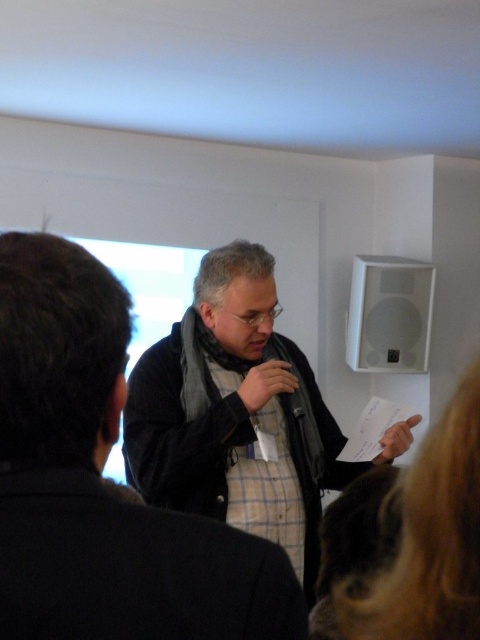
Question: Which is farther from the blonde hair at lower right?

Choices:
 (A) matte black jacket at center
 (B) dark gray fabric jacket at center

Answer: (A)

Question: Does matte black jacket at center appear on the left side of blonde hair at lower right?

Choices:
 (A) no
 (B) yes

Answer: (B)

Question: Does matte black jacket at center appear over blonde hair at lower right?

Choices:
 (A) yes
 (B) no

Answer: (B)

Question: Which object is positioned farthest from the blonde hair at lower right?

Choices:
 (A) matte black jacket at center
 (B) dark gray fabric jacket at center

Answer: (A)

Question: Can you confirm if matte black jacket at center is positioned to the right of blonde hair at lower right?

Choices:
 (A) no
 (B) yes

Answer: (A)

Question: Estimate the real-world distances between objects in this image. Which object is closer to the dark gray fabric jacket at center?

Choices:
 (A) blonde hair at lower right
 (B) matte black jacket at center

Answer: (A)